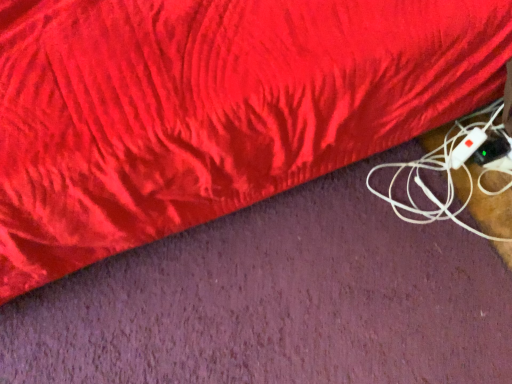
Question: Should I look upward or downward to see white plastic game controller at lower right?

Choices:
 (A) up
 (B) down

Answer: (A)